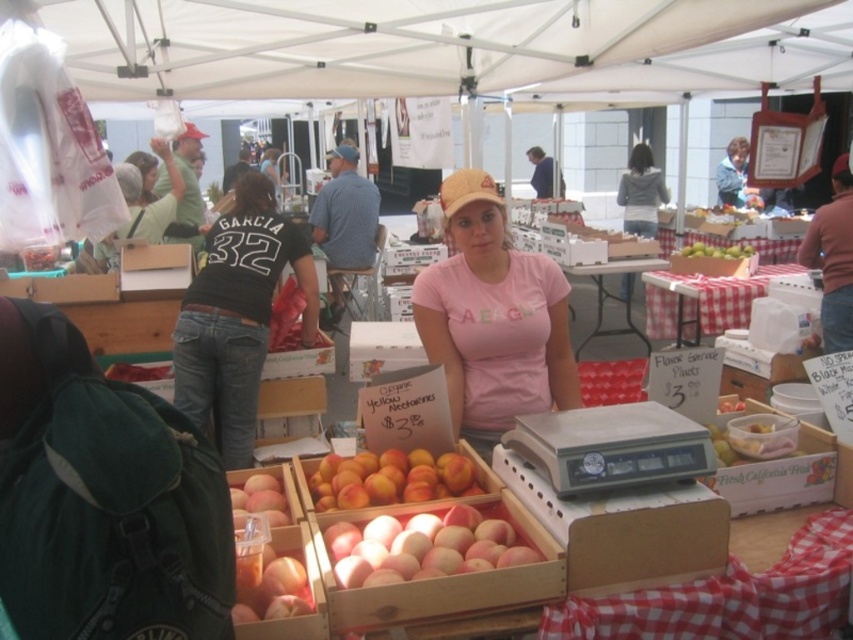
Does point (706, 620) come in front of point (541, 172)?

Yes.

Consider the image. Between red checkered tablecloth at center and blue denim jacket at upper center, which one is positioned lower?

Positioned lower is red checkered tablecloth at center.

Is point (741, 625) in front of point (563, 180)?

Yes, point (741, 625) is closer to viewer.

Locate an element on the screen. The width and height of the screenshot is (853, 640). red checkered tablecloth at center is located at coordinates (729, 596).

Which is behind, point (477, 406) or point (624, 225)?

The point (624, 225) is behind.

In the scene shown: Does pink cotton t-shirt at center come behind gray fleece jacket at upper center?

No, it is in front of gray fleece jacket at upper center.

The image size is (853, 640). Describe the element at coordinates (492, 317) in the screenshot. I see `pink cotton t-shirt at center` at that location.

Image resolution: width=853 pixels, height=640 pixels. Find the location of `pink cotton t-shirt at center`. pink cotton t-shirt at center is located at coordinates 492,317.

Measure the distance between white fabric canopy at upper center and camera.

white fabric canopy at upper center is 3.32 meters away from camera.

You are a GUI agent. You are given a task and a screenshot of the screen. Output one action in this format:
    pyautogui.click(x=<x>, y=<y>)
    Task: Click on the white fabric canopy at upper center
    This screenshot has height=640, width=853.
    Given the screenshot: What is the action you would take?
    pyautogui.click(x=450, y=48)